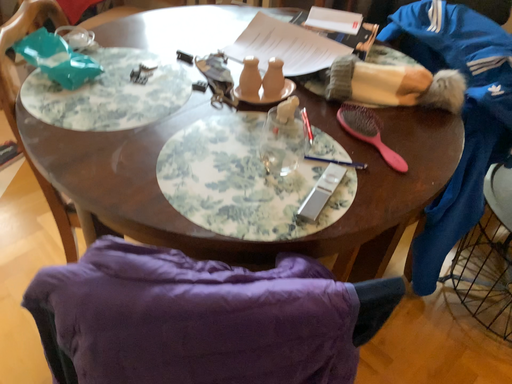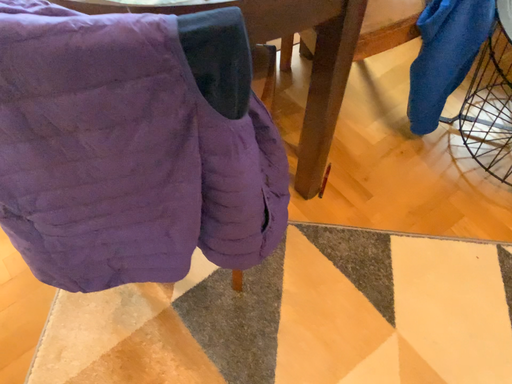
Question: Which way did the camera rotate in the video?

Choices:
 (A) rotated left
 (B) rotated right

Answer: (A)